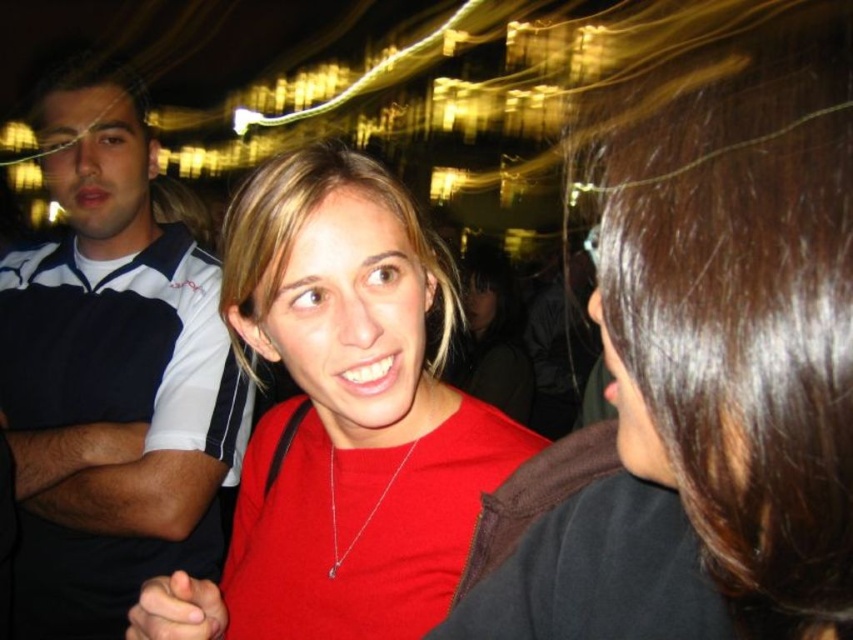
Question: Which is nearer to the white and navy polo shirt at left?

Choices:
 (A) shiny brown hair at upper right
 (B) matte red shirt at center

Answer: (B)

Question: Which is nearer to the shiny brown hair at upper right?

Choices:
 (A) matte red shirt at center
 (B) white and navy polo shirt at left

Answer: (A)

Question: Observing the image, what is the correct spatial positioning of shiny brown hair at upper right in reference to white and navy polo shirt at left?

Choices:
 (A) above
 (B) below

Answer: (A)

Question: Is shiny brown hair at upper right thinner than matte red shirt at center?

Choices:
 (A) yes
 (B) no

Answer: (A)

Question: Can you confirm if shiny brown hair at upper right is positioned to the left of matte red shirt at center?

Choices:
 (A) yes
 (B) no

Answer: (B)

Question: Which of the following is the farthest from the observer?

Choices:
 (A) white and navy polo shirt at left
 (B) matte red shirt at center

Answer: (A)